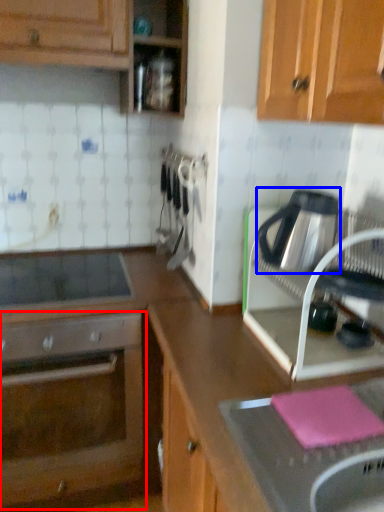
Question: Among these objects, which one is nearest to the camera, oven (highlighted by a red box) or kitchen appliance (highlighted by a blue box)?

Choices:
 (A) oven
 (B) kitchen appliance

Answer: (B)